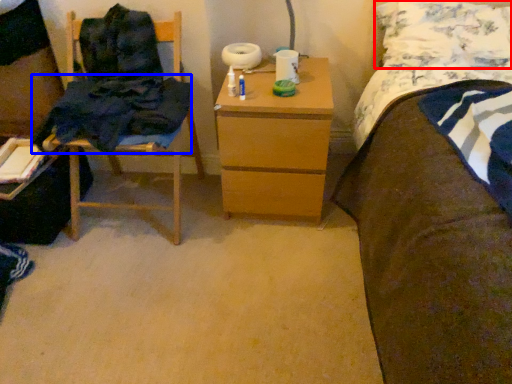
Question: Which point is further to the camera, pillow (highlighted by a red box) or clothing (highlighted by a blue box)?

Choices:
 (A) pillow
 (B) clothing

Answer: (A)